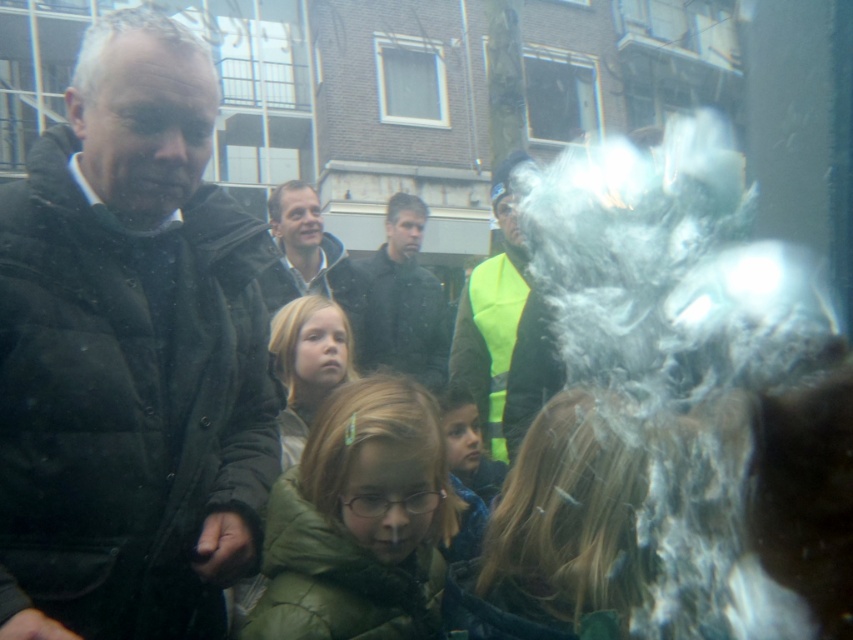
Question: Which point appears closest to the camera in this image?

Choices:
 (A) (335, 316)
 (B) (395, 384)

Answer: (B)

Question: Which object is farther from the camera taking this photo?

Choices:
 (A) blonde hair at center
 (B) matte black jacket at center
 (C) dark green jacket at center
 (D) matte black jacket at left

Answer: (B)

Question: Which object appears farthest from the camera in this image?

Choices:
 (A) blonde hair at center
 (B) matte black jacket at center

Answer: (B)

Question: Does matte black jacket at left have a smaller size compared to neon yellow reflective vest at center?

Choices:
 (A) yes
 (B) no

Answer: (A)

Question: Is green fuzzy coat at center positioned behind blonde hair at center?

Choices:
 (A) no
 (B) yes

Answer: (A)

Question: Does matte black jacket at left have a smaller size compared to matte black jacket at center?

Choices:
 (A) yes
 (B) no

Answer: (A)